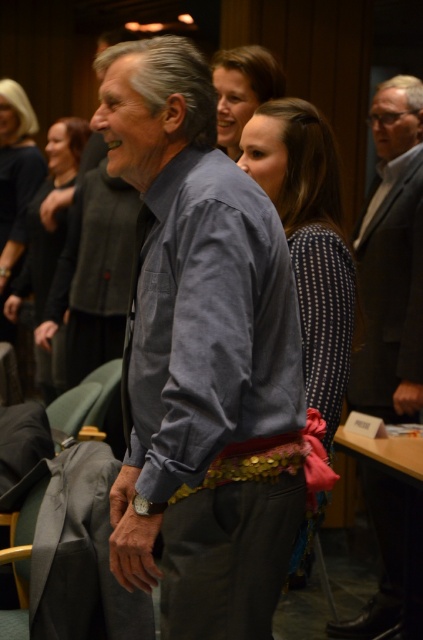
Is polka dot blouse at center taller than matte black dress at center?

Indeed, polka dot blouse at center has a greater height compared to matte black dress at center.

Is polka dot blouse at center to the left of matte black dress at center from the viewer's perspective?

No, polka dot blouse at center is not to the left of matte black dress at center.

Where is `polka dot blouse at center`? The height and width of the screenshot is (640, 423). polka dot blouse at center is located at coordinates (308, 240).

Which of these two, polka dot blouse at center or smooth brown hair at upper center, stands taller?

polka dot blouse at center is taller.

The image size is (423, 640). Describe the element at coordinates (308, 240) in the screenshot. I see `polka dot blouse at center` at that location.

Where is `polka dot blouse at center`? polka dot blouse at center is located at coordinates (308, 240).

Find the location of `polka dot blouse at center`. polka dot blouse at center is located at coordinates (308, 240).

How distant is denim shirt at center from polka dot blouse at center?

denim shirt at center and polka dot blouse at center are 18.61 inches apart from each other.

Who is shorter, denim shirt at center or polka dot blouse at center?

With less height is denim shirt at center.

Measure the distance between point (x=197, y=198) and camera.

4.74 feet

You are a GUI agent. You are given a task and a screenshot of the screen. Output one action in this format:
    pyautogui.click(x=<x>, y=<y>)
    Task: Click on the denim shirt at center
    Image resolution: width=423 pixels, height=640 pixels.
    Given the screenshot: What is the action you would take?
    pyautogui.click(x=202, y=356)